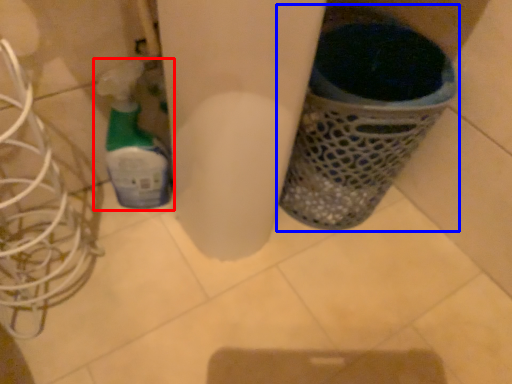
Question: Which object is closer to the camera taking this photo, bottle (highlighted by a red box) or waste container (highlighted by a blue box)?

Choices:
 (A) bottle
 (B) waste container

Answer: (B)